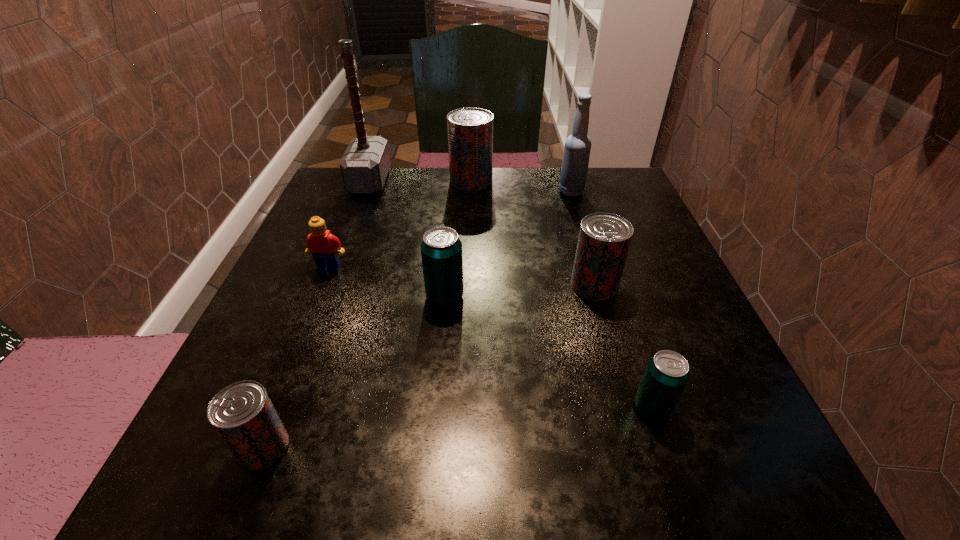
At what (x,y) coordinates should I click in order to perform the action: click on free space between the bottle and the left teal beer can. Please return your answer as a coordinate pair (x, y). Image resolution: width=960 pixels, height=540 pixels. Looking at the image, I should click on (508, 244).

Identify the location of vacant region between the farther teal beer can and the leftmost red beer can. Image resolution: width=960 pixels, height=540 pixels. (354, 372).

The image size is (960, 540). In order to click on free space that is in between the brown hammer and the smallest red beer can in this screenshot , I will do `click(317, 314)`.

The image size is (960, 540). In order to click on free space between the tallest beer can and the brown hammer in this screenshot , I will do `click(420, 181)`.

At what (x,y) coordinates should I click in order to perform the action: click on free space between the second red beer can from left to right and the brown hammer. Please return your answer as a coordinate pair (x, y). Looking at the image, I should click on (420, 181).

This screenshot has height=540, width=960. Identify the location of free space between the second red beer can from right to left and the brown hammer. (420, 181).

The image size is (960, 540). Identify the location of free space that is in between the tallest object and the left teal beer can. (407, 239).

Where is `vacant space in between the second farthest red beer can and the second red beer can from left to right`? The height and width of the screenshot is (540, 960). vacant space in between the second farthest red beer can and the second red beer can from left to right is located at coordinates point(533,233).

Find the location of `vacant space that is in between the second tallest object and the smaller teal beer can`. vacant space that is in between the second tallest object and the smaller teal beer can is located at coordinates (612, 300).

Locate which object is the sixth closest to the Lego. Please provide its 2D coordinates. Your answer should be formatted as a tuple, i.e. [(x, y)], where the tuple contains the x and y coordinates of a point satisfying the conditions above.

[(577, 148)]